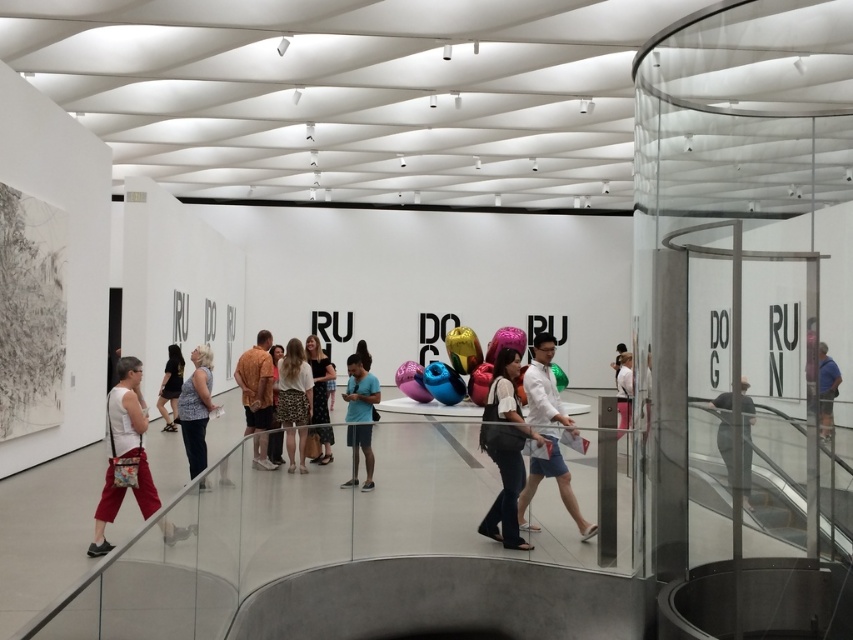
Who is higher up, blue matte shirt at center or white matte jacket at center?

blue matte shirt at center

The width and height of the screenshot is (853, 640). Identify the location of blue matte shirt at center. (360, 417).

Is white cotton shirt at center above black dress at center?

Incorrect, white cotton shirt at center is not positioned above black dress at center.

Is point (527, 385) closer to camera compared to point (315, 360)?

Yes, point (527, 385) is closer to viewer.

What do you see at coordinates (548, 435) in the screenshot? I see `white cotton shirt at center` at bounding box center [548, 435].

Locate an element on the screen. white cotton shirt at center is located at coordinates (548, 435).

Consider the image. Which is below, blue fabric pants at right or matte black dress at center?

matte black dress at center is below.

Who is positioned more to the right, blue fabric pants at right or matte black dress at center?

blue fabric pants at right is more to the right.

Locate an element on the screen. The height and width of the screenshot is (640, 853). blue fabric pants at right is located at coordinates (827, 388).